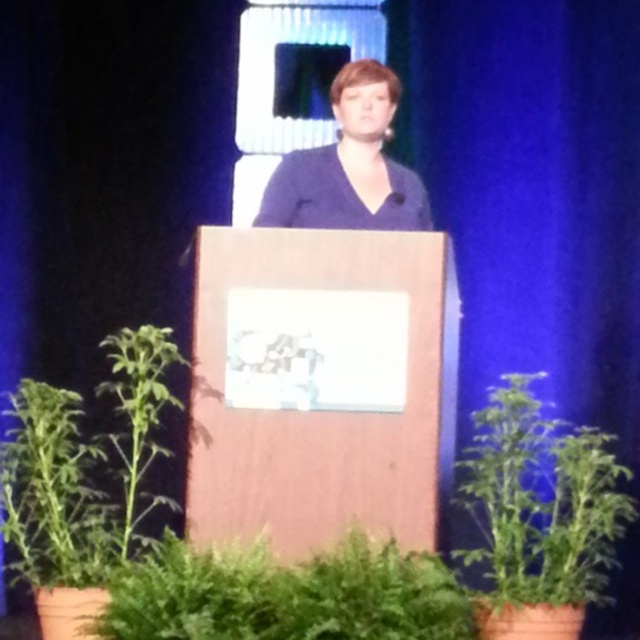
You are a stagehand setting up for an event. You need to place a new decorative item between the green leafy plant at lower center and the blue matte dress at center. Considering their sizes, which one should you place the item closer to to ensure it doesn

The green leafy plant at lower center is wider than the blue matte dress at center. To ensure the decorative item is placed appropriately between them, you should position it closer to the blue matte dress at center since the plant is wider and might require more space.

You are a stagehand who needs to move the green leafy plant at lower center and the green leafy plant at lower left closer together. Currently, how far apart are they?

The green leafy plant at lower center is 20.65 inches away from the green leafy plant at lower left, so they are currently 20.65 inches apart.